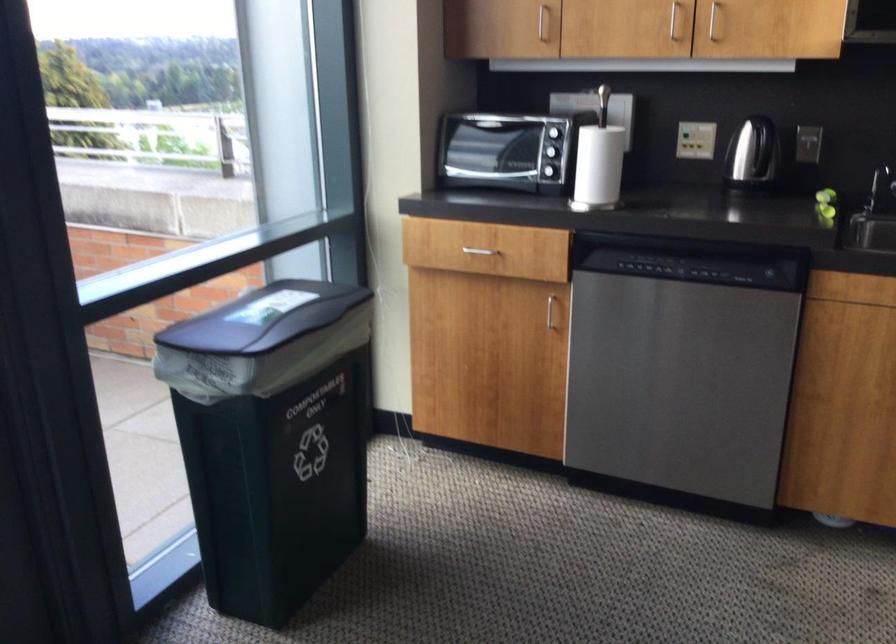
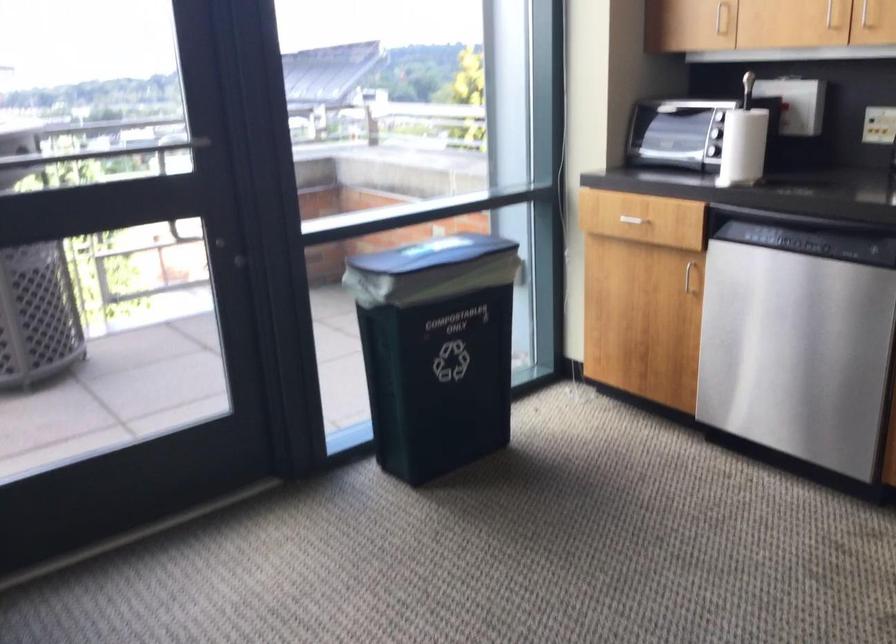
Question: The first image is from the beginning of the video and the second image is from the end. How did the camera likely rotate when shooting the video?

Choices:
 (A) Left
 (B) Right
 (C) Up
 (D) Down

Answer: (A)